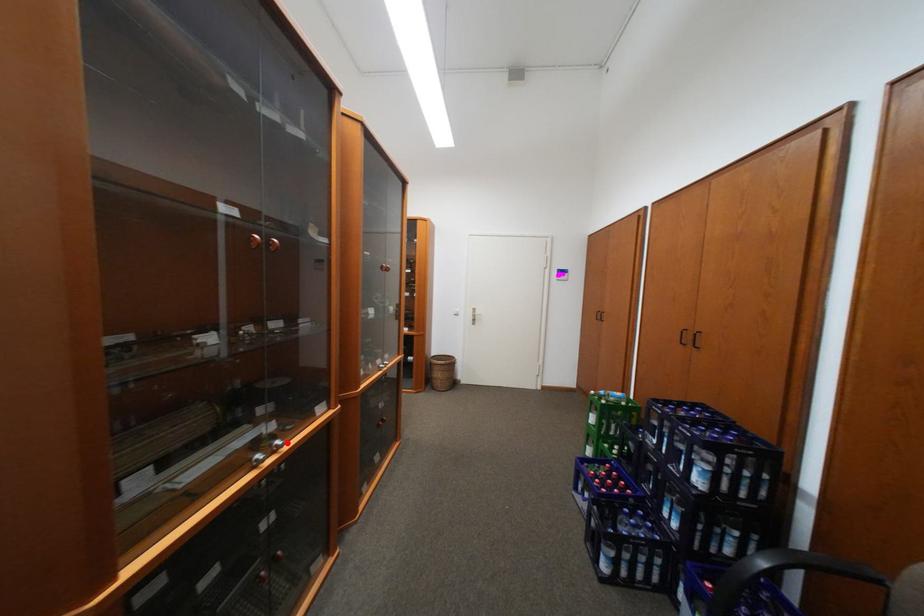
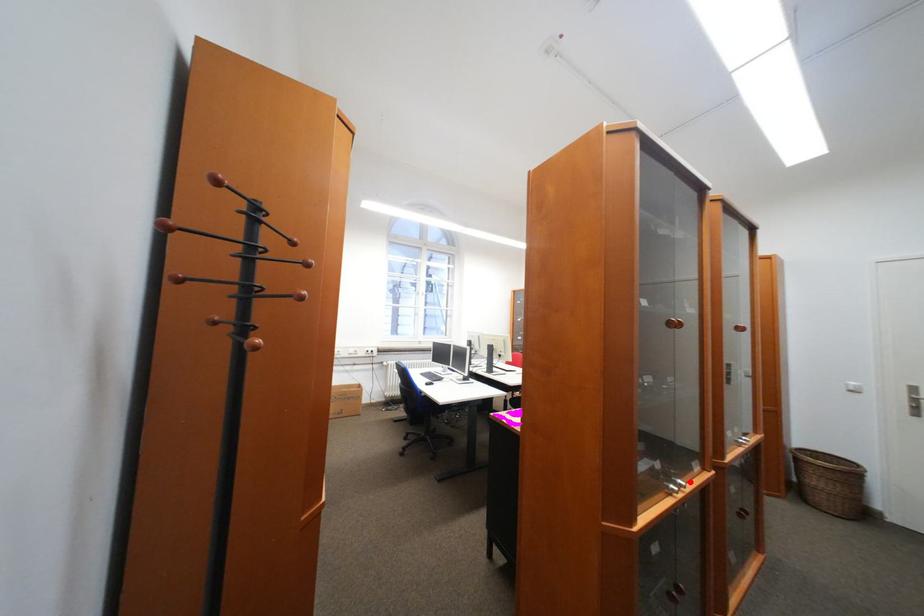
I am providing you with two images of the same scene from different viewpoints. A red point is marked on the first image and another point is marked on the second image. Is the marked point in image1 the same physical position as the marked point in image2?

Yes